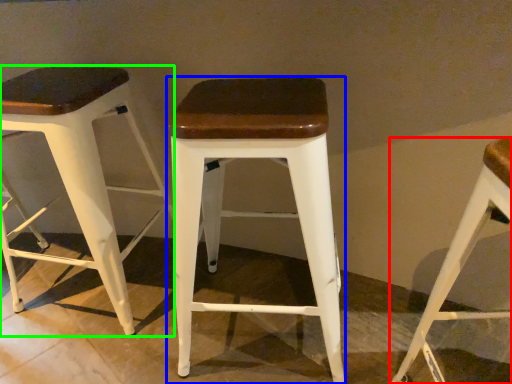
Question: Based on their relative distances, which object is farther from stool (highlighted by a red box)? Choose from stool (highlighted by a blue box) and stool (highlighted by a green box).

Choices:
 (A) stool
 (B) stool

Answer: (B)